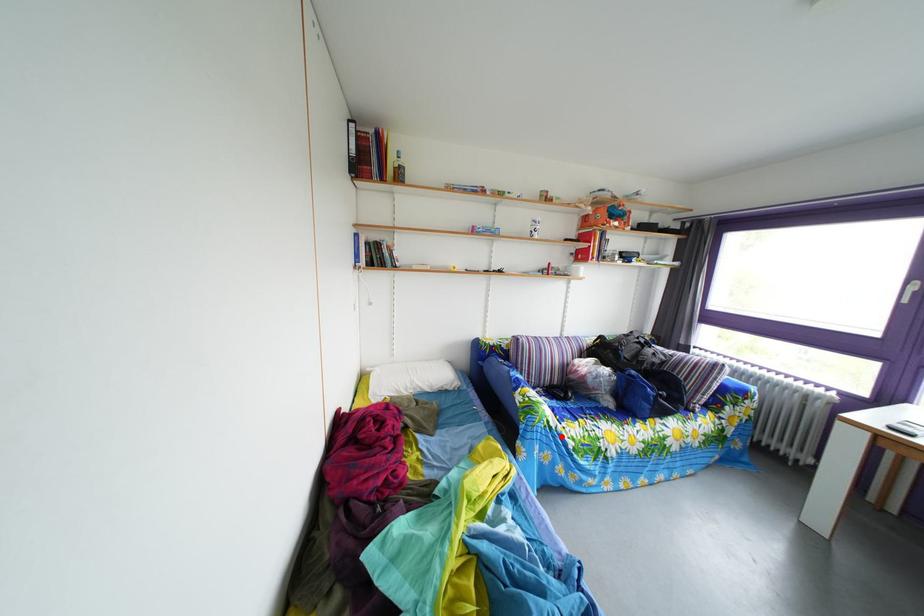
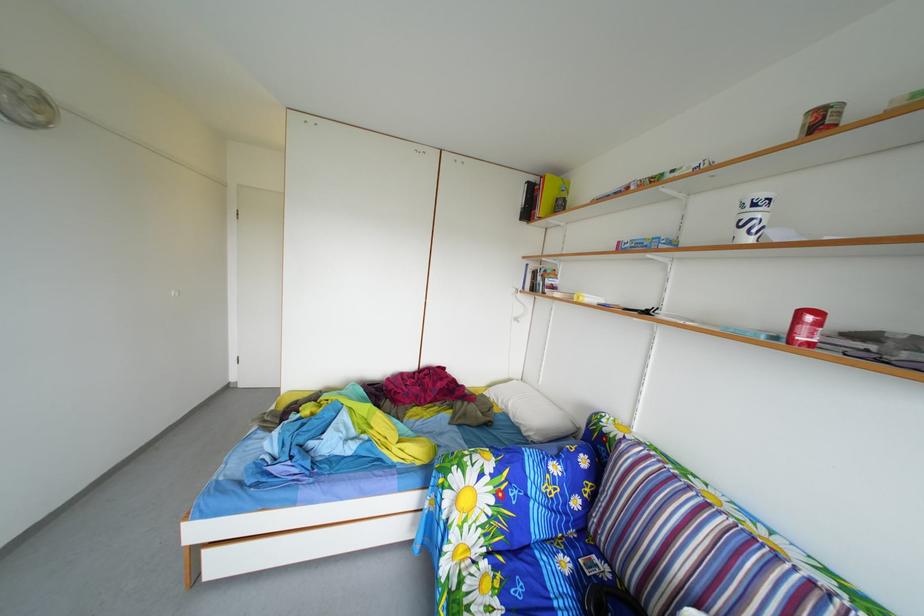
Find the pixel in the second image that matches the highlighted location in the first image.

(453, 507)